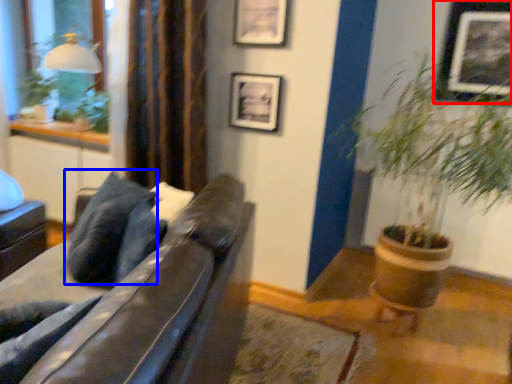
Question: Which object appears closest to the camera in this image, picture frame (highlighted by a red box) or pillow (highlighted by a blue box)?

Choices:
 (A) picture frame
 (B) pillow

Answer: (B)